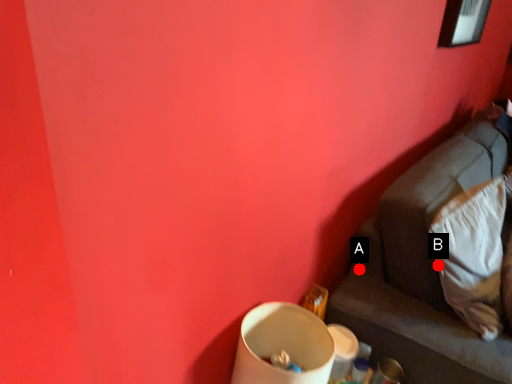
Question: Two points are circled on the image, labeled by A and B beside each circle. Which point is closer to the camera?

Choices:
 (A) A is closer
 (B) B is closer

Answer: (B)